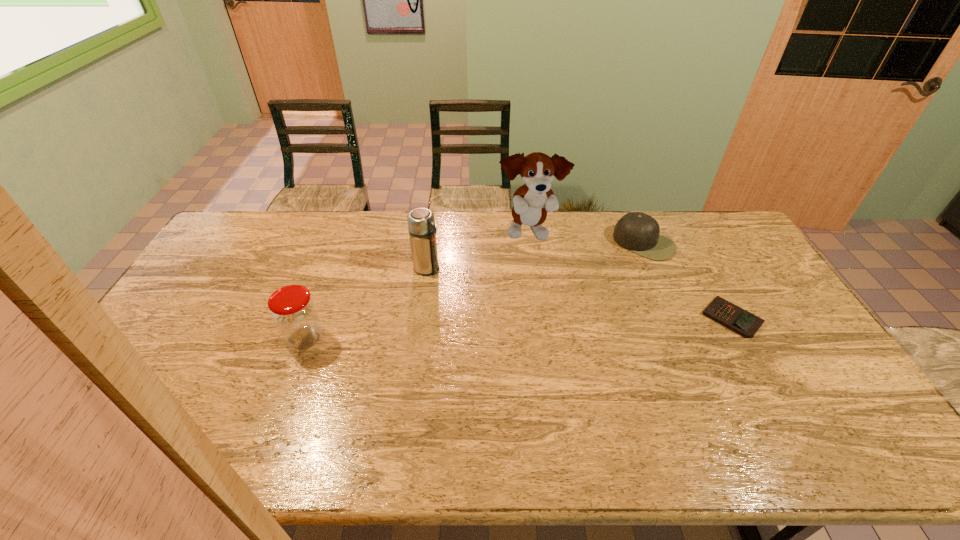
Locate an element on the screen. This screenshot has width=960, height=540. free space between the thermos bottle and the cap is located at coordinates (536, 256).

Find the location of `free space between the third shortest object and the cap`. free space between the third shortest object and the cap is located at coordinates (475, 291).

The width and height of the screenshot is (960, 540). In order to click on empty space that is in between the fourth object from right to left and the shortest object in this screenshot , I will do `click(580, 293)`.

This screenshot has height=540, width=960. I want to click on unoccupied position between the second shortest object and the second object from left to right, so pyautogui.click(x=536, y=256).

Where is `empty space that is in between the calculator and the thermos bottle`? empty space that is in between the calculator and the thermos bottle is located at coordinates (580, 293).

Identify the location of vacant area between the thermos bottle and the third tallest object. This screenshot has width=960, height=540. (x=366, y=303).

The height and width of the screenshot is (540, 960). What are the coordinates of `free spot between the third object from left to right and the thermos bottle` in the screenshot? It's located at (478, 251).

At what (x,y) coordinates should I click in order to perform the action: click on vacant point located between the leftmost object and the tallest object. Please return your answer as a coordinate pair (x, y). Looking at the image, I should click on (418, 286).

Where is `object that can be found as the fourth closest to the fourth shortest object`? object that can be found as the fourth closest to the fourth shortest object is located at coordinates (733, 317).

Locate which object ranks second in proximity to the cap. Please provide its 2D coordinates. Your answer should be formatted as a tuple, i.e. [(x, y)], where the tuple contains the x and y coordinates of a point satisfying the conditions above.

[(532, 201)]